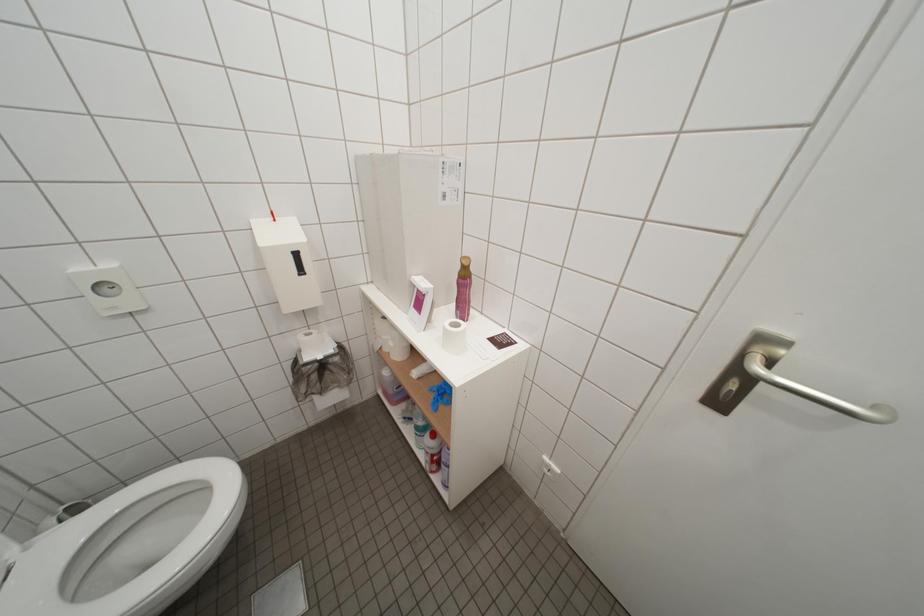
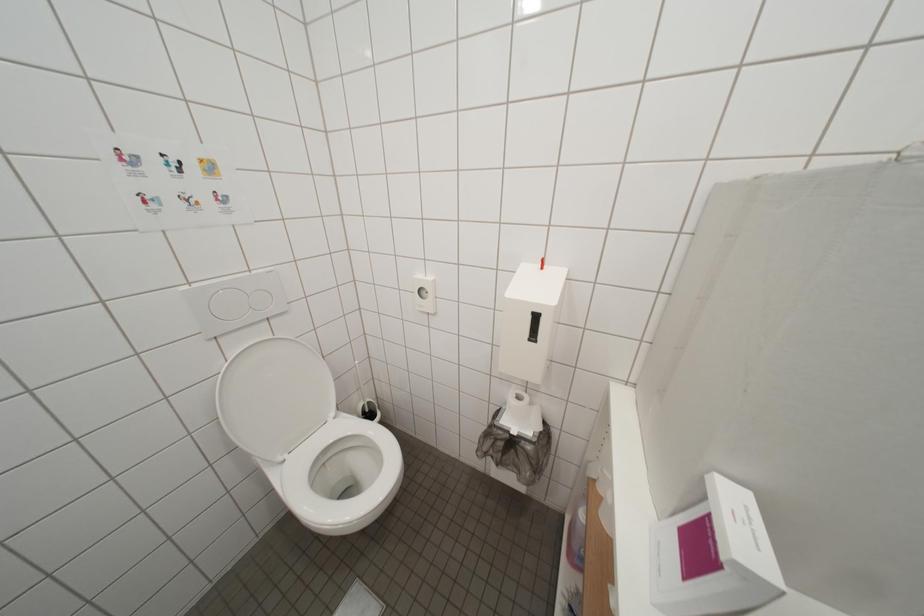
Question: The images are taken continuously from a first-person perspective. In which direction is your viewpoint rotating?

Choices:
 (A) Left
 (B) Right
 (C) Up
 (D) Down

Answer: (A)